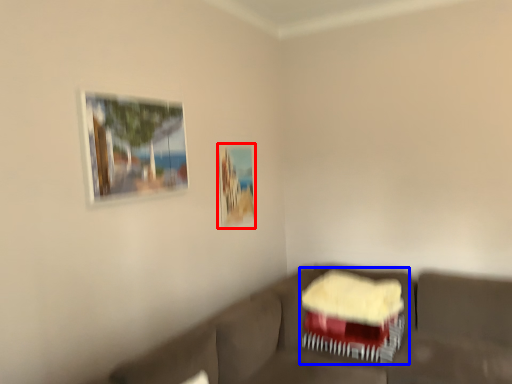
Question: Among these objects, which one is nearest to the camera, picture frame (highlighted by a red box) or swivel chair (highlighted by a blue box)?

Choices:
 (A) picture frame
 (B) swivel chair

Answer: (B)